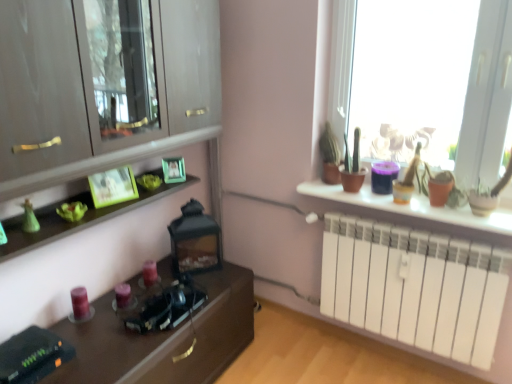
Where is `matte green picture frame at center, the first picture frame in the back-to-front sequence`? Image resolution: width=512 pixels, height=384 pixels. matte green picture frame at center, the first picture frame in the back-to-front sequence is located at coordinates (174, 170).

Where is `matte purple candle at lower left, which is the first candle from left to right`? This screenshot has width=512, height=384. matte purple candle at lower left, which is the first candle from left to right is located at coordinates (80, 303).

The image size is (512, 384). What do you see at coordinates (80, 303) in the screenshot?
I see `matte purple candle at lower left, which is the second candle from right to left` at bounding box center [80, 303].

Measure the distance between translucent glass window at upper right and camera.

translucent glass window at upper right is 1.64 meters away from camera.

At what (x,y) coordinates should I click in order to perform the action: click on white matte radiator at right. Please return your answer as a coordinate pair (x, y). Looking at the image, I should click on (415, 287).

The width and height of the screenshot is (512, 384). What are the coordinates of `matte wood cabinet at left` in the screenshot? It's located at (93, 80).

At what (x,y) coordinates should I click in order to perform the action: click on matte green picture frame at center, the first picture frame in the back-to-front sequence. Please return your answer as a coordinate pair (x, y). The image size is (512, 384). Looking at the image, I should click on (174, 170).

From the image's perspective, is matte purple candle at lower left, which is the 2th candle from left to right, over matte white radiator at right?

No.

Who is bigger, matte purple candle at lower left, which is the 2th candle from left to right, or matte white radiator at right?

Bigger between the two is matte white radiator at right.

Does matte purple candle at lower left, which is the 2th candle from left to right, appear on the right side of matte white radiator at right?

No.

Identify the location of the 2nd candle positioned below the matte white radiator at right (from a real-world perspective). (122, 295).

Can you confirm if white matte radiator at right is positioned to the left of translucent glass window at upper right?

Yes, white matte radiator at right is to the left of translucent glass window at upper right.

Does point (373, 300) come behind point (482, 91)?

Yes, point (373, 300) is behind point (482, 91).

From the image's perspective, who appears lower, white matte radiator at right or translucent glass window at upper right?

white matte radiator at right.

Is point (128, 299) closer or farther from the camera than point (106, 188)?

Point (128, 299) is farther from the camera than point (106, 188).

Are matte purple candle at lower left, which is the 2th candle from left to right, and green matte picture frame at upper left, which appears as the first picture frame when viewed from the front, located far from each other?

matte purple candle at lower left, which is the 2th candle from left to right, is actually quite close to green matte picture frame at upper left, which appears as the first picture frame when viewed from the front.

Could you tell me if matte purple candle at lower left, which is counted as the 1th candle, starting from the right, is facing green matte picture frame at upper left, which is the first picture frame from left to right?

No, matte purple candle at lower left, which is counted as the 1th candle, starting from the right, is not facing towards green matte picture frame at upper left, which is the first picture frame from left to right.

Does matte white radiator at right have a lesser height compared to matte purple candle at lower left, which is the first candle from left to right?

Yes, matte white radiator at right is shorter than matte purple candle at lower left, which is the first candle from left to right.

Are matte white radiator at right and matte purple candle at lower left, which is the first candle from left to right, making contact?

No, matte white radiator at right is not with matte purple candle at lower left, which is the first candle from left to right.

Based on the photo, how much distance is there between matte white radiator at right and matte purple candle at lower left, which is the second candle from right to left?

1.42 meters.

How many degrees apart are the facing directions of matte white radiator at right and matte purple candle at lower left, which is the first candle from left to right?

The angle between the facing direction of matte white radiator at right and the facing direction of matte purple candle at lower left, which is the first candle from left to right, is 88.4 degrees.

From the image's perspective, between matte green picture frame at center, the 2th picture frame viewed from the left, and translucent glass window at upper right, which one is located above?

translucent glass window at upper right is shown above in the image.

Considering the positions of objects matte green picture frame at center, the 2th picture frame viewed from the left, and translucent glass window at upper right in the image provided, who is behind, matte green picture frame at center, the 2th picture frame viewed from the left, or translucent glass window at upper right?

matte green picture frame at center, the 2th picture frame viewed from the left, is further from the camera.

Which point is more forward, (37, 104) or (468, 302)?

Positioned in front is point (37, 104).

Which is more to the left, matte wood cabinet at left or white matte radiator at right?

From the viewer's perspective, matte wood cabinet at left appears more on the left side.

Is matte wood cabinet at left positioned behind white matte radiator at right?

That is False.

Locate an element on the screen. cabinetry above the white matte radiator at right (from a real-world perspective) is located at coordinates (93, 80).

From the image's perspective, between white matte radiator at right and matte green picture frame at center, the first picture frame positioned from the right, who is located below?

white matte radiator at right, from the image's perspective.

In terms of height, does white matte radiator at right look taller or shorter compared to matte green picture frame at center, the 2th picture frame viewed from the left?

In the image, white matte radiator at right appears to be taller than matte green picture frame at center, the 2th picture frame viewed from the left.

Which object is thinner, white matte radiator at right or matte green picture frame at center, the 2th picture frame when ordered from front to back?

matte green picture frame at center, the 2th picture frame when ordered from front to back, is thinner.

At what (x,y) coordinates should I click in order to perform the action: click on radiator in front of the matte green picture frame at center, the first picture frame in the back-to-front sequence. Please return your answer as a coordinate pair (x, y). The height and width of the screenshot is (384, 512). Looking at the image, I should click on (415, 287).

Where is `table that is above the matte purple candle at lower left, which is the 2th candle from left to right (from the image's perspective)`? This screenshot has height=384, width=512. table that is above the matte purple candle at lower left, which is the 2th candle from left to right (from the image's perspective) is located at coordinates (411, 213).

You are a GUI agent. You are given a task and a screenshot of the screen. Output one action in this format:
    pyautogui.click(x=<x>, y=<y>)
    Task: Click on the window that appears in front of the white matte radiator at right
    The height and width of the screenshot is (384, 512).
    Given the screenshot: What is the action you would take?
    pyautogui.click(x=486, y=96)

From the image, which object appears to be nearer to matte white radiator at right, matte purple candle at lower left, which is the first candle from left to right, or matte wood cabinet at left?

matte wood cabinet at left is closer to matte white radiator at right.

From the image, which object appears to be nearer to matte white radiator at right, translucent glass window at upper right or green matte picture frame at upper left, which is the first picture frame from left to right?

translucent glass window at upper right is closer to matte white radiator at right.

Considering their positions, is matte wood cabinet at left positioned further to green matte picture frame at upper left, acting as the second picture frame starting from the back, than white matte radiator at right?

Among the two, white matte radiator at right is located further to green matte picture frame at upper left, acting as the second picture frame starting from the back.

Based on the photo, estimate the real-world distances between objects in this image. Which object is closer to matte wood cabinet at left, matte green picture frame at center, the 2th picture frame when ordered from front to back, or matte purple candle at lower left, which is the second candle from right to left?

Based on the image, matte green picture frame at center, the 2th picture frame when ordered from front to back, appears to be nearer to matte wood cabinet at left.

When comparing their distances from matte purple candle at lower left, which is counted as the 1th candle, starting from the right, does translucent glass window at upper right or matte white radiator at right seem closer?

matte white radiator at right.

Based on their spatial positions, is white matte radiator at right or matte wood cabinet at left further from matte purple candle at lower left, which is the 2th candle from left to right?

Based on the image, white matte radiator at right appears to be further to matte purple candle at lower left, which is the 2th candle from left to right.

Looking at the image, which one is located closer to matte white radiator at right, white matte radiator at right or matte purple candle at lower left, which is the 2th candle from left to right?

Among the two, white matte radiator at right is located nearer to matte white radiator at right.

When comparing their distances from matte purple candle at lower left, which is the first candle from left to right, does translucent glass window at upper right or matte white radiator at right seem further?

Among the two, translucent glass window at upper right is located further to matte purple candle at lower left, which is the first candle from left to right.

The image size is (512, 384). Identify the location of radiator between matte wood cabinet at left and matte green picture frame at center, the 2th picture frame when ordered from front to back, from front to back. click(415, 287).

The width and height of the screenshot is (512, 384). I want to click on cabinetry situated between matte purple candle at lower left, which is counted as the 1th candle, starting from the right, and white matte radiator at right from left to right, so click(93, 80).

You are a GUI agent. You are given a task and a screenshot of the screen. Output one action in this format:
    pyautogui.click(x=<x>, y=<y>)
    Task: Click on the candle located between matte purple candle at lower left, which is the second candle from right to left, and translucent glass window at upper right in the left-right direction
    The height and width of the screenshot is (384, 512).
    Given the screenshot: What is the action you would take?
    tap(122, 295)

Locate an element on the screen. picture frame between green matte picture frame at upper left, which appears as the first picture frame when viewed from the front, and translucent glass window at upper right is located at coordinates (174, 170).